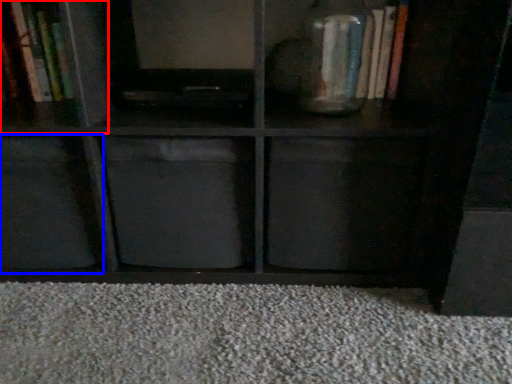
Question: Which of the following is the farthest to the observer, cabinet (highlighted by a red box) or cabinet (highlighted by a blue box)?

Choices:
 (A) cabinet
 (B) cabinet

Answer: (A)